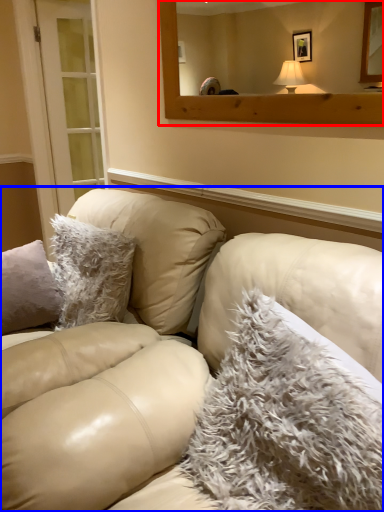
Question: Which of the following is the farthest to the observer, mirror (highlighted by a red box) or studio couch (highlighted by a blue box)?

Choices:
 (A) mirror
 (B) studio couch

Answer: (A)